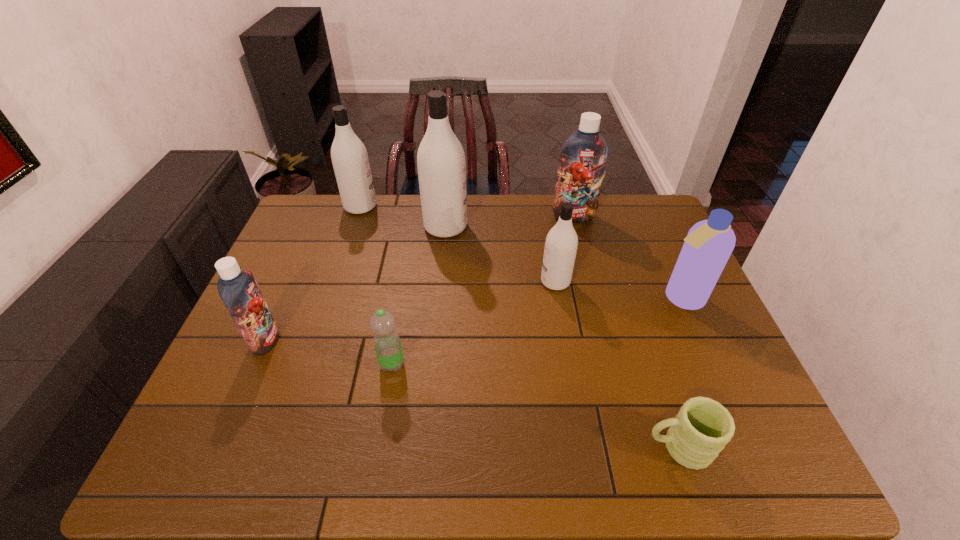
Identify the location of object positioned at the far left corner. The image size is (960, 540). (349, 156).

This screenshot has height=540, width=960. I want to click on object that is positioned at the near right corner, so click(x=699, y=432).

Identify the location of vacant space at the far edge of the desktop. This screenshot has width=960, height=540. (520, 221).

The image size is (960, 540). I want to click on free space at the near edge, so click(639, 434).

You are a GUI agent. You are given a task and a screenshot of the screen. Output one action in this format:
    pyautogui.click(x=<x>, y=<y>)
    Task: Click on the blank space at the left edge of the desktop
    The height and width of the screenshot is (540, 960).
    Given the screenshot: What is the action you would take?
    pyautogui.click(x=299, y=274)

In the image, there is a desktop. At what (x,y) coordinates should I click in order to perform the action: click on vacant space at the right edge. Please return your answer as a coordinate pair (x, y). Looking at the image, I should click on (708, 355).

The width and height of the screenshot is (960, 540). In order to click on free space at the far right corner in this screenshot , I will do point(652,219).

The image size is (960, 540). In order to click on free point between the rightmost object and the green water bottle in this screenshot , I will do `click(537, 331)`.

Find the location of a particular element. vacant region between the nearest object and the nearest shampoo is located at coordinates (471, 394).

You are a GUI agent. You are given a task and a screenshot of the screen. Output one action in this format:
    pyautogui.click(x=<x>, y=<y>)
    Task: Click on the vacant area that lies between the rightmost shampoo and the nearest white shampoo
    
    Given the screenshot: What is the action you would take?
    pyautogui.click(x=618, y=290)